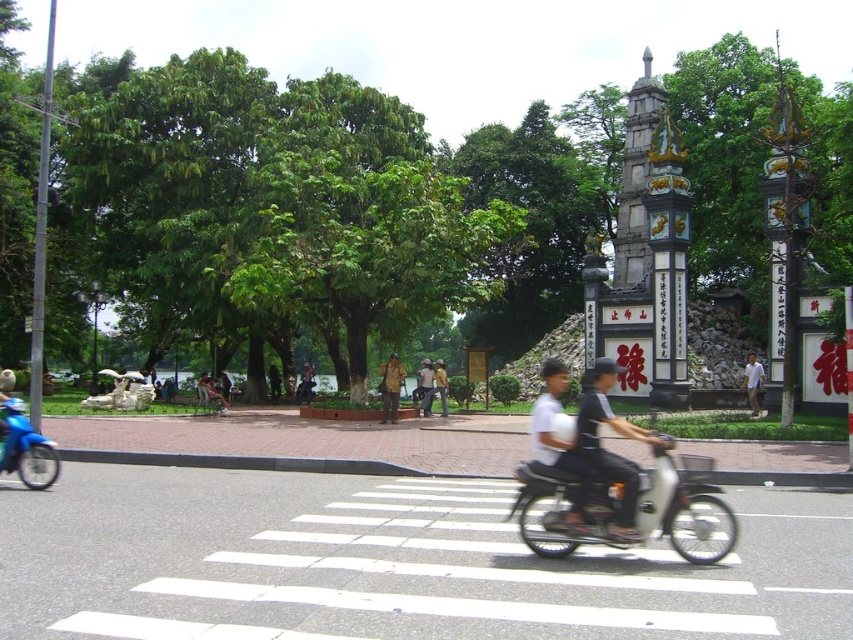
Consider the image. Where is the metallic silver motorcycle at center located in the image?

The metallic silver motorcycle at center is located at point coordinates of (633, 508).

You are a pedestrian standing at the pedestrian crossing. You see a metallic silver motorcycle at center and a yellow fabric jacket at center. Which object is taller?

The yellow fabric jacket at center is taller than the metallic silver motorcycle at center.

You are a photographer standing at the edge of the pedestrian crossing. You notice two people wearing a dark gray fabric shirt at center and khaki fabric pants at center. Which clothing item is positioned to the right when looking at them from your perspective?

The dark gray fabric shirt at center is to the right of the khaki fabric pants at center, so the dark gray fabric shirt at center is positioned to the right.